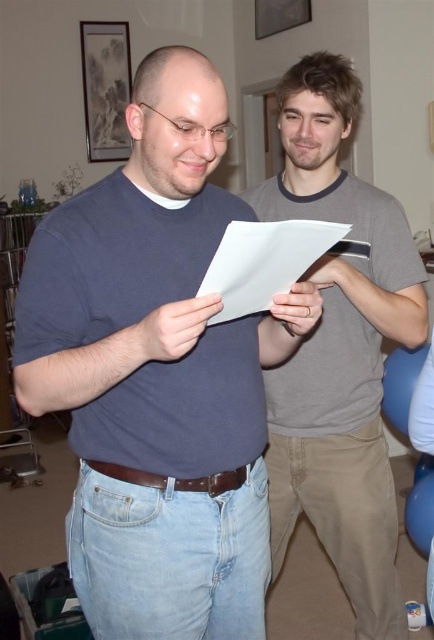
Does point (368, 513) come behind point (233, 260)?

Yes, it is behind point (233, 260).

Is point (341, 330) positioned behind point (266, 307)?

Yes, it is.

You are a GUI agent. You are given a task and a screenshot of the screen. Output one action in this format:
    pyautogui.click(x=<x>, y=<y>)
    Task: Click on the gray cotton t-shirt at center
    This screenshot has width=434, height=640.
    Given the screenshot: What is the action you would take?
    pyautogui.click(x=339, y=348)

Can you confirm if matte blue shirt at center is taller than gray cotton t-shirt at center?

No, matte blue shirt at center is not taller than gray cotton t-shirt at center.

Does matte blue shirt at center lie behind gray cotton t-shirt at center?

No, it is in front of gray cotton t-shirt at center.

Does point (240, 602) come in front of point (361, 307)?

Yes, point (240, 602) is in front of point (361, 307).

The width and height of the screenshot is (434, 640). Find the location of `matte blue shirt at center`. matte blue shirt at center is located at coordinates (157, 374).

Is point (191, 289) positioned in front of point (302, 228)?

No, it is not.

Who is lower down, matte blue shirt at center or white paper at center?

matte blue shirt at center is below.

Between point (154, 189) and point (275, 228), which one is positioned in front?

Point (275, 228)

This screenshot has height=640, width=434. Find the location of `matte blue shirt at center`. matte blue shirt at center is located at coordinates (157, 374).